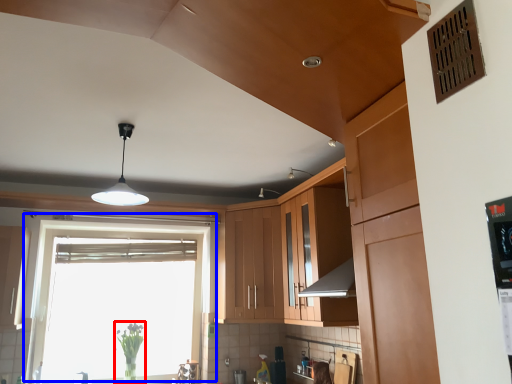
Question: Among these objects, which one is farthest to the camera, plant (highlighted by a red box) or window (highlighted by a blue box)?

Choices:
 (A) plant
 (B) window

Answer: (A)